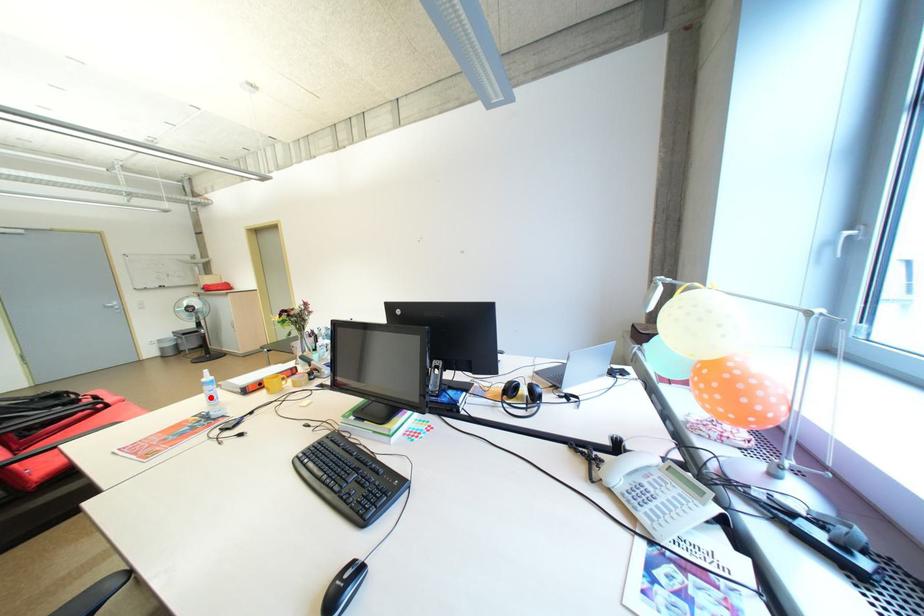
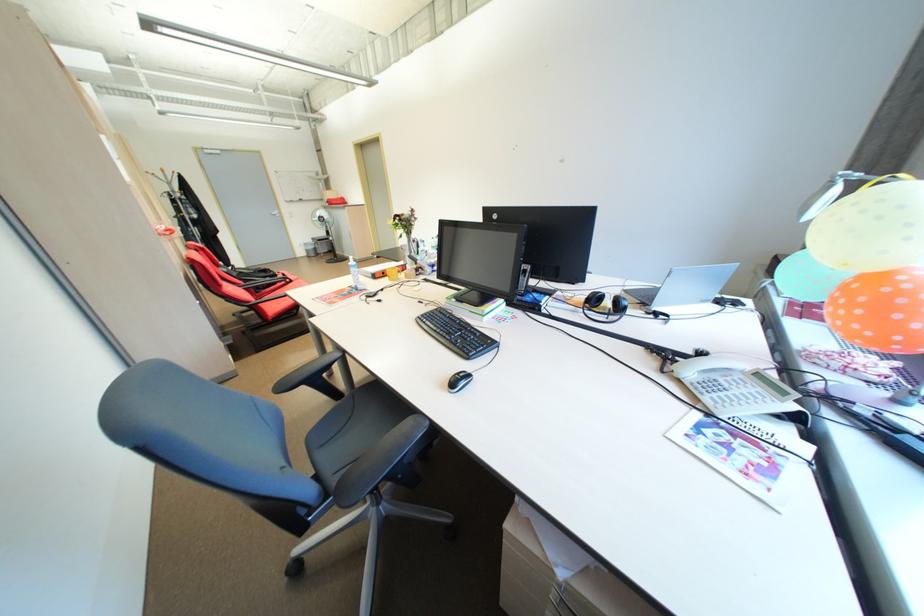
Find the pixel in the second image that matches the highlighted location in the first image.

(359, 277)